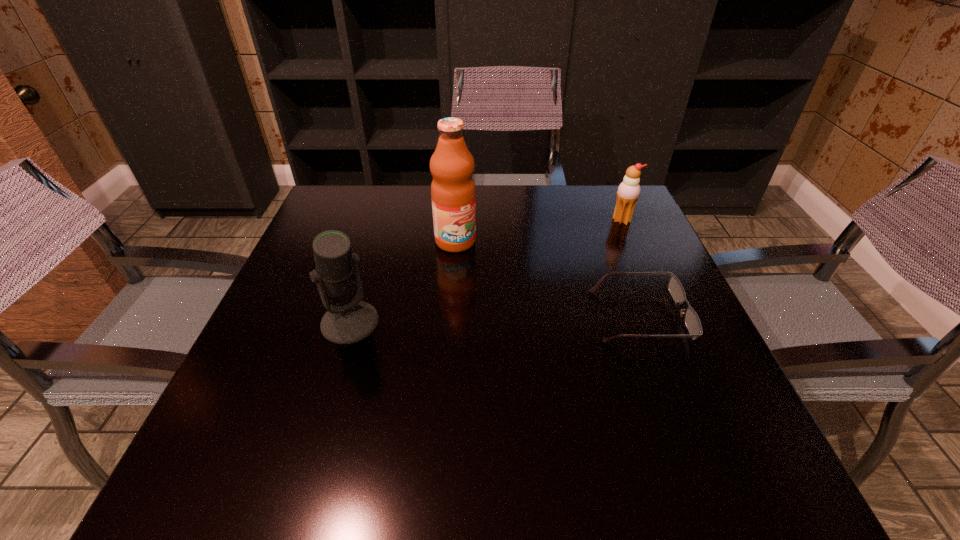
You are a GUI agent. You are given a task and a screenshot of the screen. Output one action in this format:
    pyautogui.click(x=<x>, y=<y>)
    Task: Click on the vacant space on the desktop that is between the third shortest object and the spectacles and is positioned on the front label of the fruit juice
    
    Given the screenshot: What is the action you would take?
    pyautogui.click(x=520, y=319)

The height and width of the screenshot is (540, 960). In order to click on vacant space on the desktop that is between the microphone and the shortest object and is positioned at the front with a straw on the third tallest object in this screenshot , I will do `click(471, 320)`.